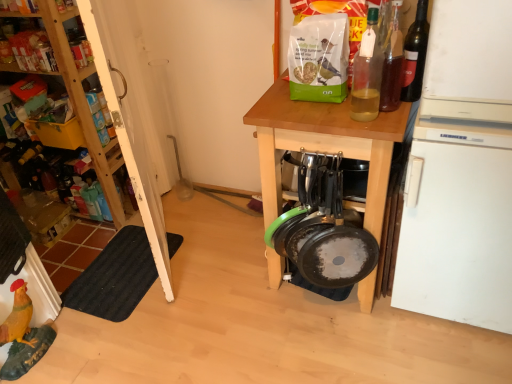
This screenshot has width=512, height=384. I want to click on free location to the left of dark glass bottle at upper right, the 1th bottle in the right-to-left sequence, so click(x=350, y=113).